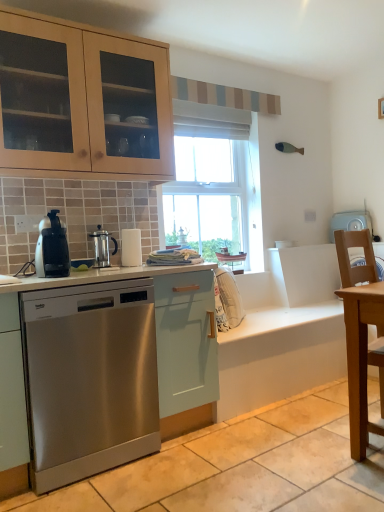
The image size is (384, 512). What are the coordinates of `free space in front of satin black coffee maker at left` in the screenshot? It's located at (44, 280).